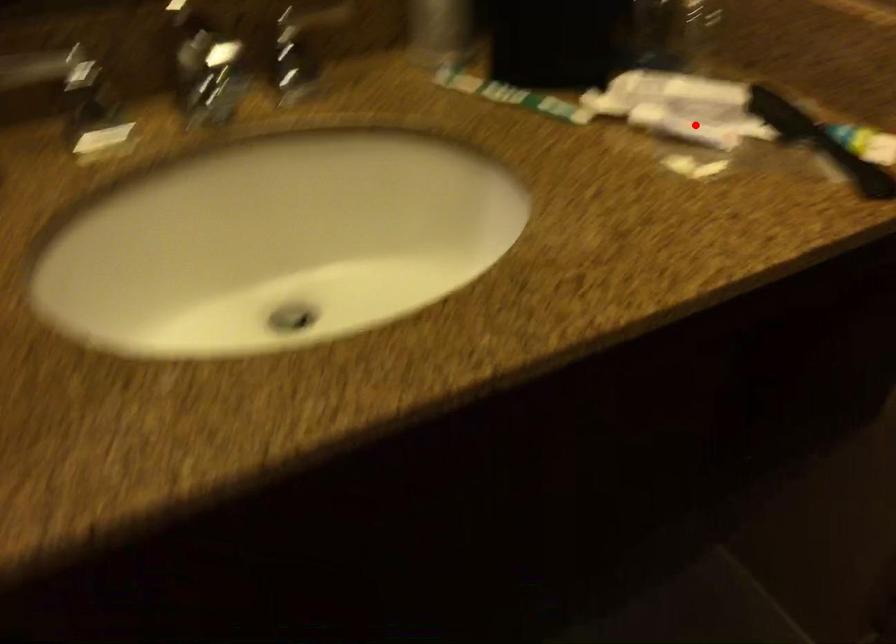
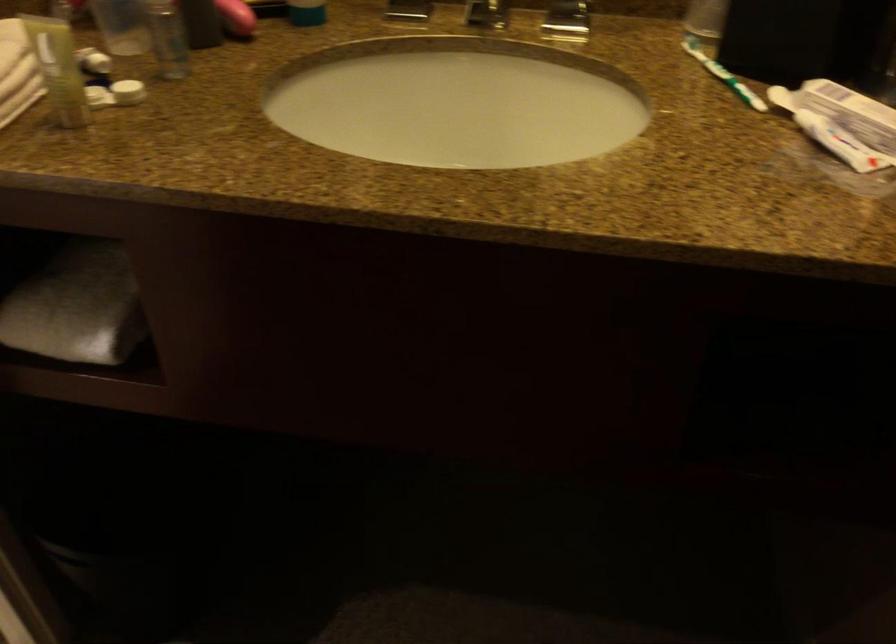
Find the pixel in the second image that matches the highlighted location in the first image.

(840, 143)